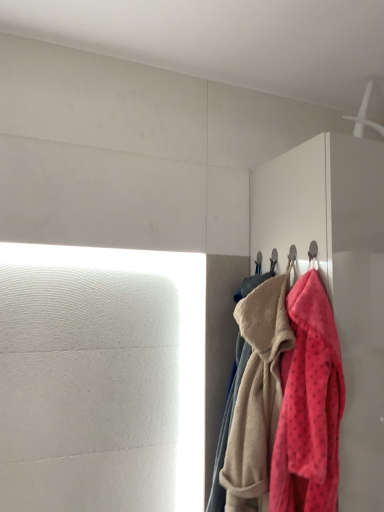
Question: In the image, is fluffy pink towel at right, placed as the 2th towel when sorted from back to front, on the left side or the right side of fluffy pink towel at right, placed as the second towel when sorted from front to back?

Choices:
 (A) left
 (B) right

Answer: (B)

Question: Is fluffy pink towel at right, acting as the 1th towel starting from the front, inside or outside of fluffy pink towel at right, marked as the first towel in a back-to-front arrangement?

Choices:
 (A) inside
 (B) outside

Answer: (B)

Question: Based on their relative distances, which object is nearer to the matte white dresser at right?

Choices:
 (A) fluffy pink towel at right, placed as the 2th towel when sorted from back to front
 (B) fluffy pink towel at right, placed as the second towel when sorted from front to back

Answer: (A)

Question: Considering the real-world distances, which object is closest to the matte white dresser at right?

Choices:
 (A) fluffy pink towel at right, placed as the second towel when sorted from front to back
 (B) fluffy pink towel at right, acting as the 1th towel starting from the front

Answer: (B)